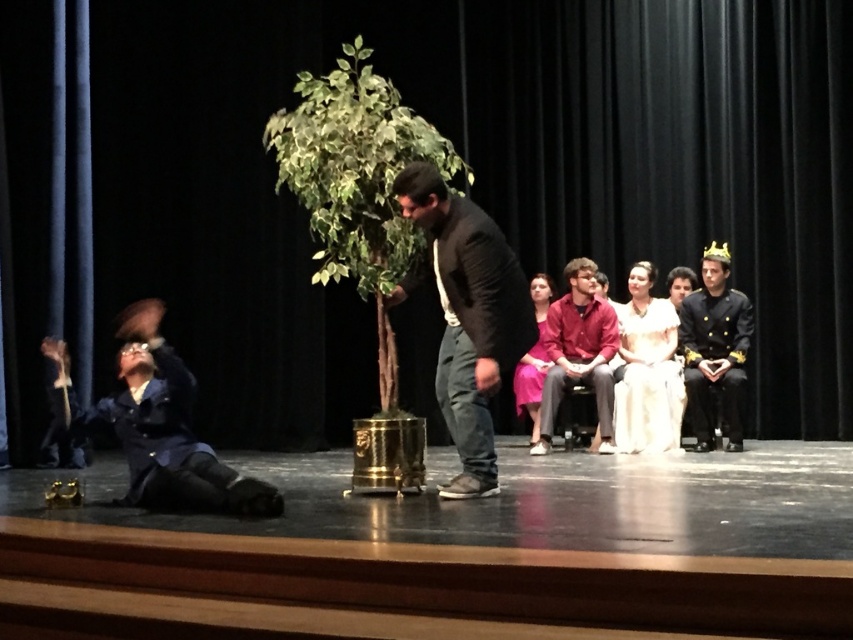
Question: Which is farther from the black shiny uniform at right?

Choices:
 (A) red cotton shirt at center
 (B) green leafy plant at center
 (C) pink satin dress at center

Answer: (B)

Question: Does black shiny uniform at right have a lesser width compared to pink satin dress at center?

Choices:
 (A) yes
 (B) no

Answer: (B)

Question: Is black shiny uniform at right to the left of pink satin dress at center from the viewer's perspective?

Choices:
 (A) yes
 (B) no

Answer: (B)

Question: Considering the relative positions of dark gray sweater at center and black shiny uniform at right in the image provided, where is dark gray sweater at center located with respect to black shiny uniform at right?

Choices:
 (A) below
 (B) above

Answer: (B)

Question: Which object is the farthest from the pink satin dress at center?

Choices:
 (A) dark gray sweater at center
 (B) green leafy plant at center
 (C) black shiny uniform at right

Answer: (A)

Question: Which object is farther from the camera taking this photo?

Choices:
 (A) blue fabric actor at lower left
 (B) pink satin dress at center

Answer: (B)